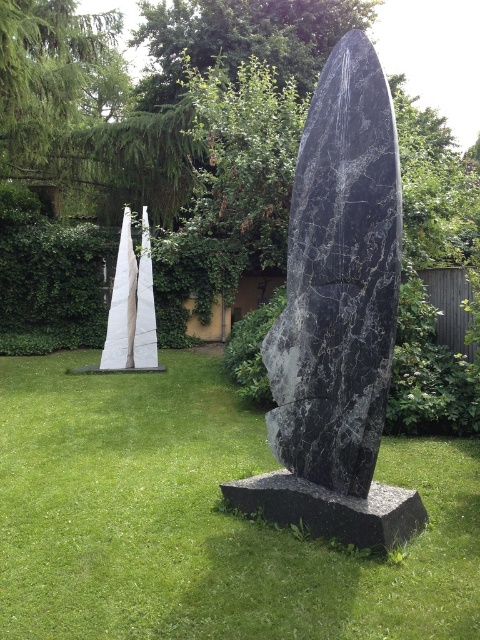
You are planning to place a small garden ornament that requires a space wider than the green grass at center. Can the black marble stone at center provide enough width for this ornament?

The green grass at center is narrower than the black marble stone at center. Since the ornament needs a space wider than the green grass at center, the black marble stone at center has sufficient width to accommodate it.